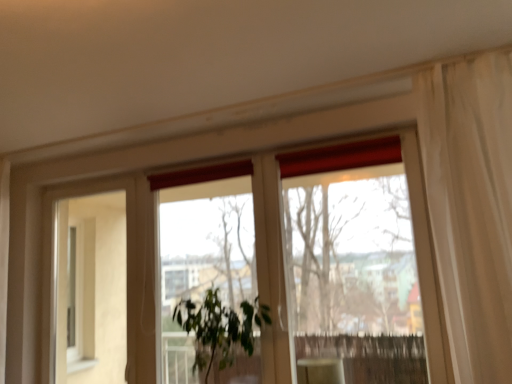
Question: Can you confirm if beige matte screen door at left is positioned to the right of matte white cabinet at lower center?

Choices:
 (A) no
 (B) yes

Answer: (A)

Question: Are beige matte screen door at left and matte white cabinet at lower center beside each other?

Choices:
 (A) yes
 (B) no

Answer: (B)

Question: From the image's perspective, would you say beige matte screen door at left is shown under matte white cabinet at lower center?

Choices:
 (A) yes
 (B) no

Answer: (B)

Question: Considering the relative sizes of beige matte screen door at left and matte white cabinet at lower center in the image provided, is beige matte screen door at left wider than matte white cabinet at lower center?

Choices:
 (A) no
 (B) yes

Answer: (A)

Question: Are beige matte screen door at left and matte white cabinet at lower center located far from each other?

Choices:
 (A) no
 (B) yes

Answer: (B)

Question: Considering the relative positions of beige matte screen door at left and matte white cabinet at lower center in the image provided, is beige matte screen door at left to the left of matte white cabinet at lower center from the viewer's perspective?

Choices:
 (A) no
 (B) yes

Answer: (B)

Question: Would you say beige matte screen door at left is outside green leafy plant at center?

Choices:
 (A) yes
 (B) no

Answer: (A)

Question: Is beige matte screen door at left shorter than green leafy plant at center?

Choices:
 (A) no
 (B) yes

Answer: (A)

Question: Is beige matte screen door at left at the right side of green leafy plant at center?

Choices:
 (A) no
 (B) yes

Answer: (A)

Question: Can you confirm if beige matte screen door at left is taller than green leafy plant at center?

Choices:
 (A) yes
 (B) no

Answer: (A)

Question: Is beige matte screen door at left far away from green leafy plant at center?

Choices:
 (A) yes
 (B) no

Answer: (A)

Question: From the image's perspective, does beige matte screen door at left appear lower than green leafy plant at center?

Choices:
 (A) yes
 (B) no

Answer: (B)

Question: Is transparent glass window at center located outside green leafy plant at center?

Choices:
 (A) yes
 (B) no

Answer: (A)